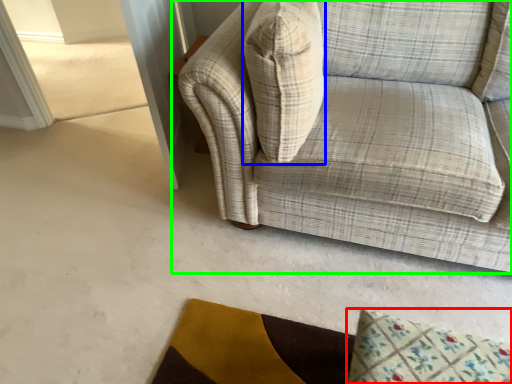
Question: Which is nearer to the mat (highlighted by a red box)? throw pillow (highlighted by a blue box) or studio couch (highlighted by a green box).

Choices:
 (A) throw pillow
 (B) studio couch

Answer: (B)